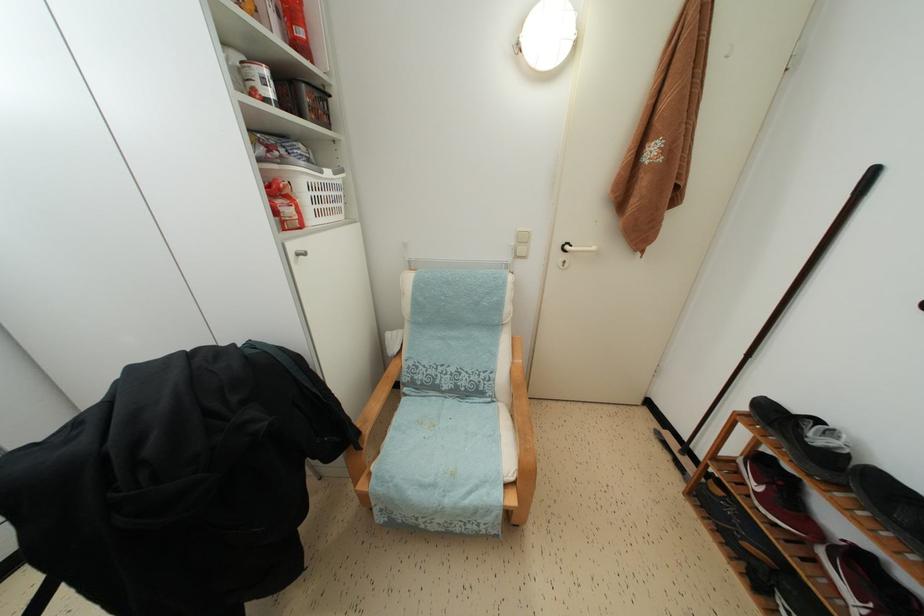
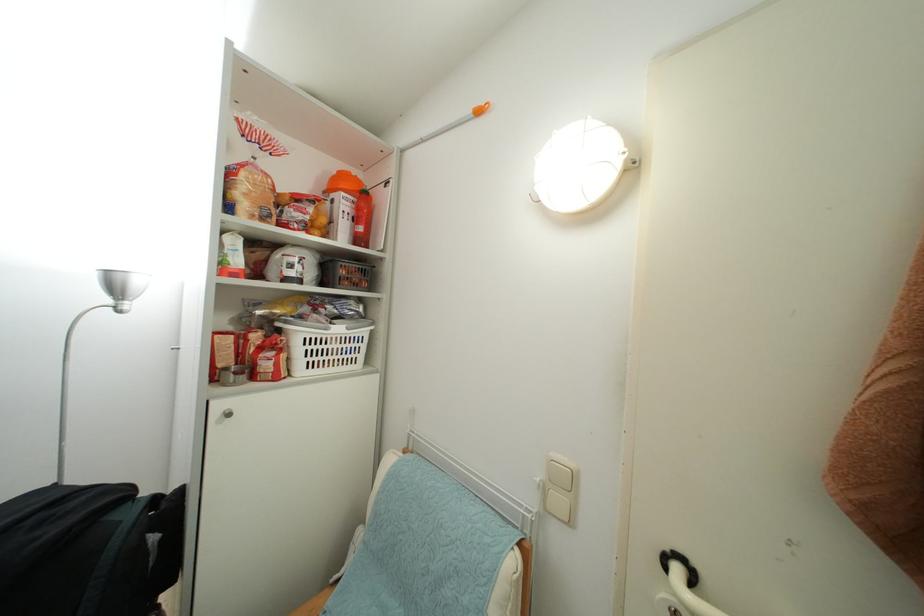
In the second image, find the point that corresponds to pixel 325 177 in the first image.

(331, 334)